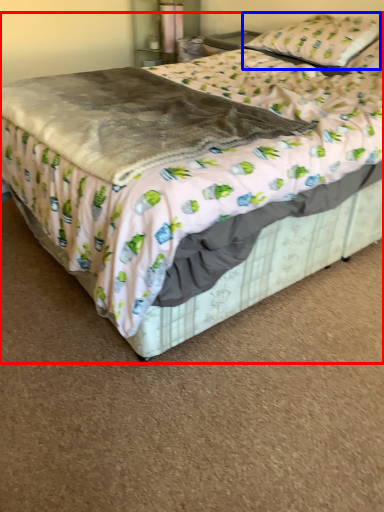
Question: Which object is further to the camera taking this photo, bed (highlighted by a red box) or pillow (highlighted by a blue box)?

Choices:
 (A) bed
 (B) pillow

Answer: (B)